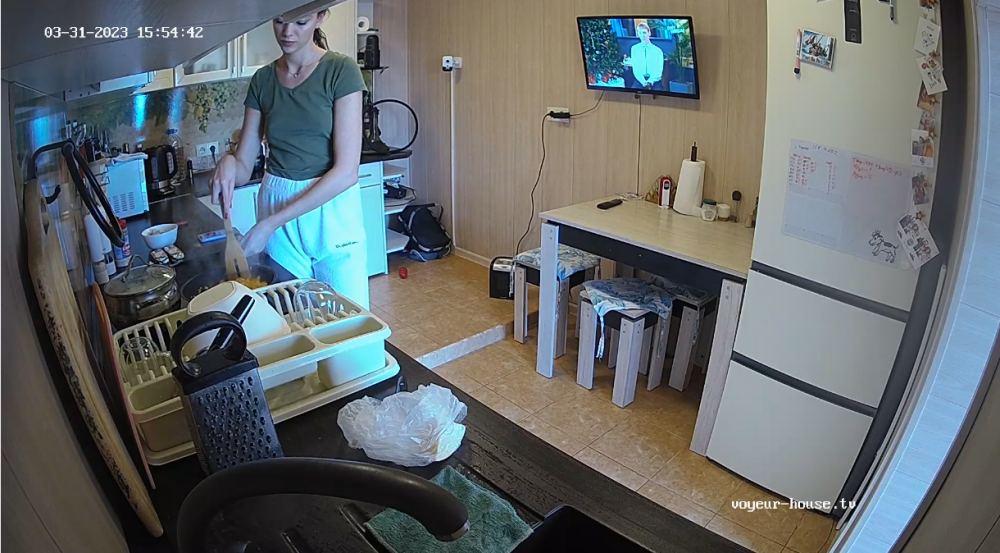
Where is `cheese grater`? This screenshot has width=1000, height=553. cheese grater is located at coordinates (228, 415).